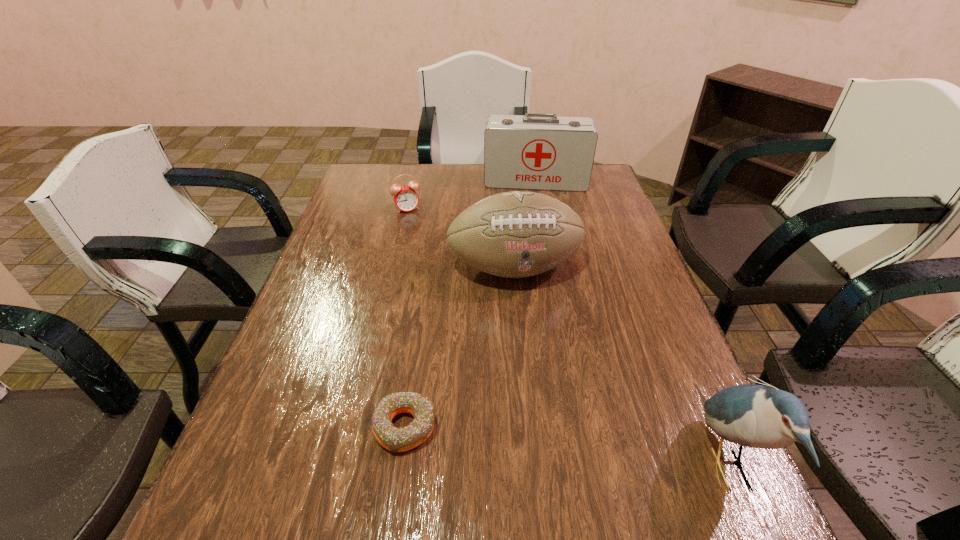
I want to click on vacant region that satisfies the following two spatial constraints: 1. on the front side of the second shortest object; 2. at the tip of the bird's beak, so click(x=348, y=467).

You are a GUI agent. You are given a task and a screenshot of the screen. Output one action in this format:
    pyautogui.click(x=<x>, y=<y>)
    Task: Click on the vacant space that satisfies the following two spatial constraints: 1. on the back side of the doughnut; 2. on the left side of the farthest object
    The width and height of the screenshot is (960, 540).
    Given the screenshot: What is the action you would take?
    pyautogui.click(x=439, y=181)